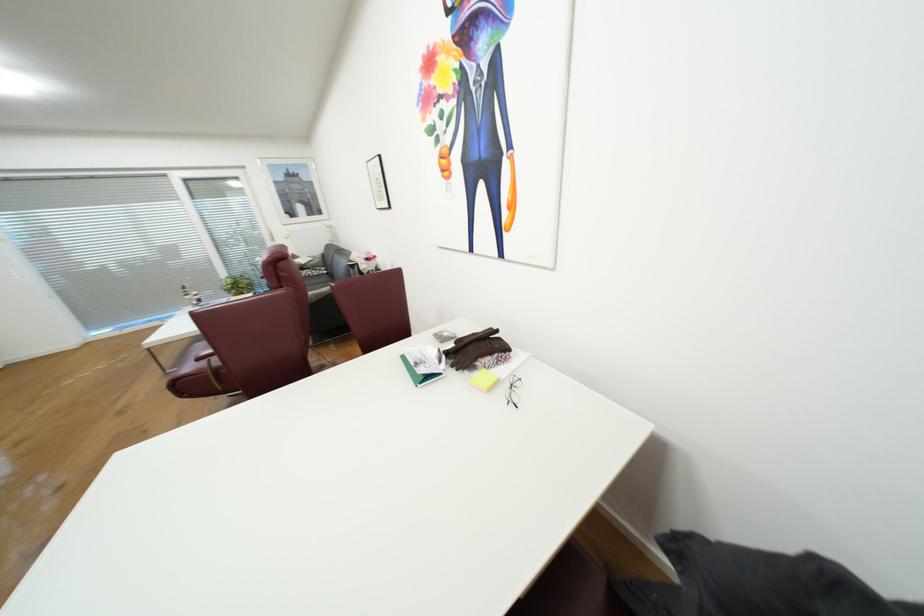
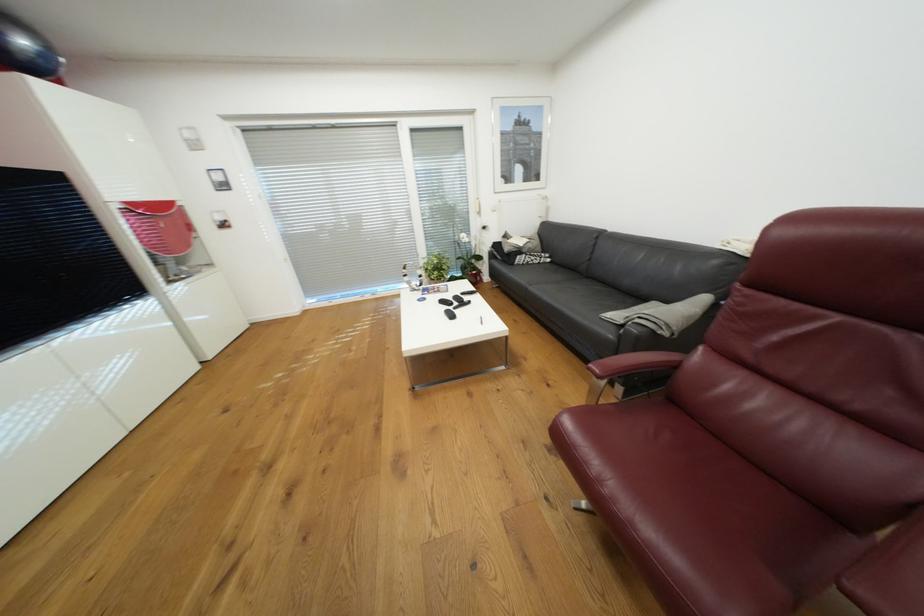
Which direction would the cameraman need to move to produce the second image?

The cameraman moved toward left, forward.